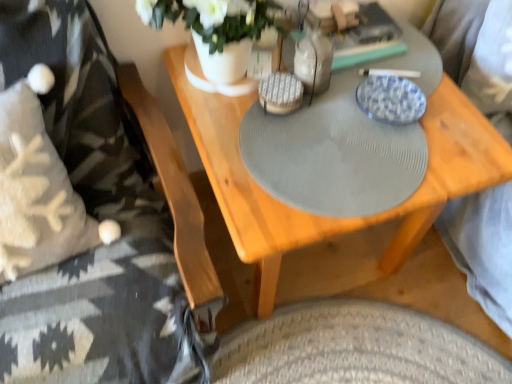
In order to click on vacant space in front of white matte vase at upper center in this screenshot , I will do `click(267, 162)`.